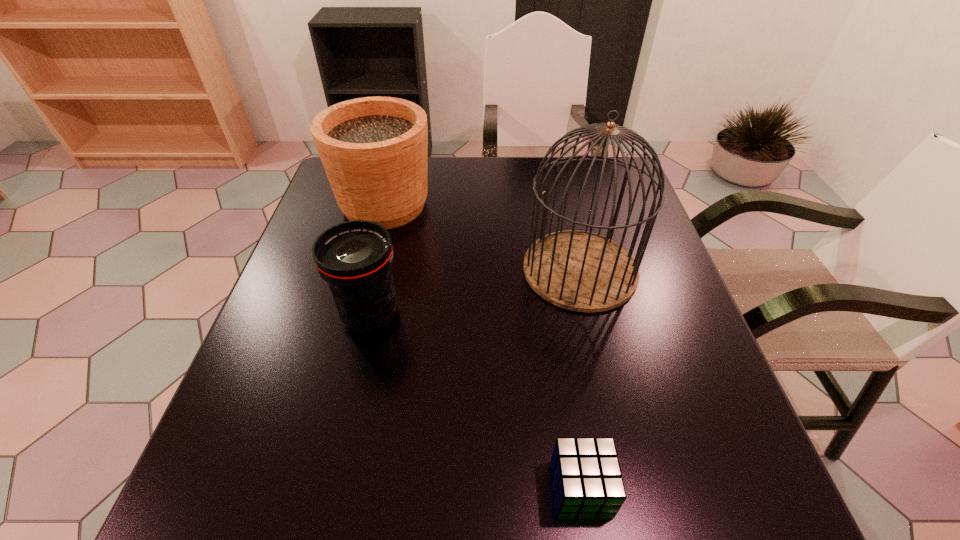
I want to click on blank region between the third tallest object and the shortest object, so click(x=475, y=402).

Identify the location of free area in between the shortest object and the second tallest object. (483, 347).

Image resolution: width=960 pixels, height=540 pixels. What are the coordinates of `the second closest object to the telephoto lens` in the screenshot? It's located at (581, 271).

Select which object is the second closest to the third shortest object. Please provide its 2D coordinates. Your answer should be formatted as a tuple, i.e. [(x, y)], where the tuple contains the x and y coordinates of a point satisfying the conditions above.

[(581, 271)]

Identify the location of vacant point that satisfies the following two spatial constraints: 1. on the front side of the nearest object; 2. on the left side of the telephoto lens. (330, 489).